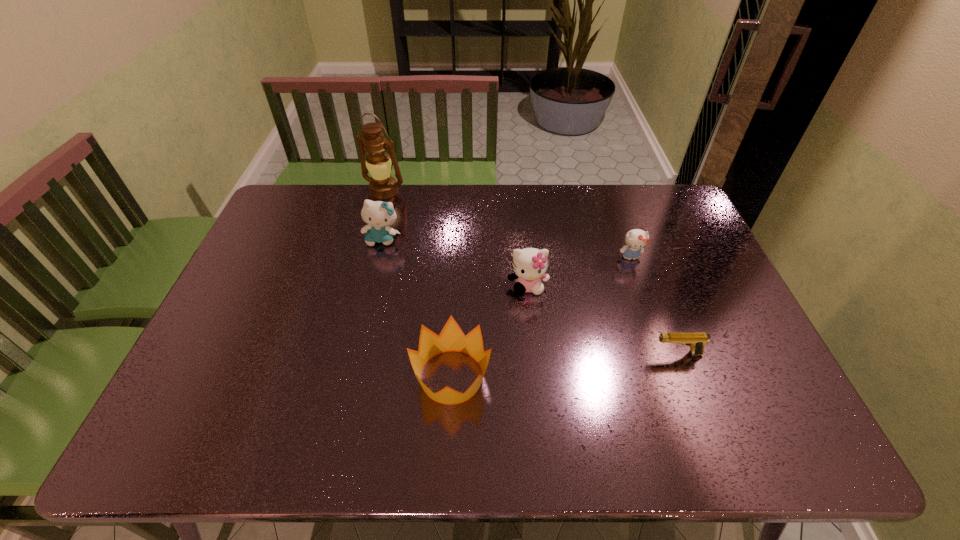
What are the coordinates of `free space at the far edge of the desktop` in the screenshot? It's located at (430, 204).

Identify the location of free space at the near edge. This screenshot has height=540, width=960. (529, 441).

Where is `blank area at the left edge`? Image resolution: width=960 pixels, height=540 pixels. blank area at the left edge is located at coordinates (287, 279).

Where is `free location at the right edge of the desktop`? free location at the right edge of the desktop is located at coordinates (673, 248).

This screenshot has width=960, height=540. In order to click on empty space that is in between the shortest kitten and the farthest object in this screenshot , I will do `click(508, 224)`.

Locate an element on the screen. free point between the crown and the tallest object is located at coordinates (419, 284).

Where is `vacant area that lies between the shortest object and the fourth farthest object`? This screenshot has height=540, width=960. vacant area that lies between the shortest object and the fourth farthest object is located at coordinates (603, 320).

The image size is (960, 540). Identify the location of vacant area that lies between the crown and the oil lamp. (419, 284).

You are a GUI agent. You are given a task and a screenshot of the screen. Output one action in this format:
    pyautogui.click(x=<x>, y=<y>)
    Task: Click on the free space between the second nearest kitten and the crown
    The image size is (960, 540).
    Given the screenshot: What is the action you would take?
    pyautogui.click(x=540, y=317)

Where is `free point between the fourth object from right to left and the fourth farthest object`? The width and height of the screenshot is (960, 540). free point between the fourth object from right to left and the fourth farthest object is located at coordinates (490, 332).